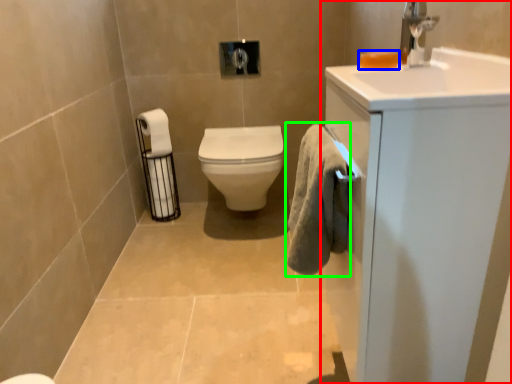
Question: Considering the real-world distances, which object is farthest from bathroom cabinet (highlighted by a red box)? soap (highlighted by a blue box) or bath towel (highlighted by a green box)?

Choices:
 (A) soap
 (B) bath towel

Answer: (A)